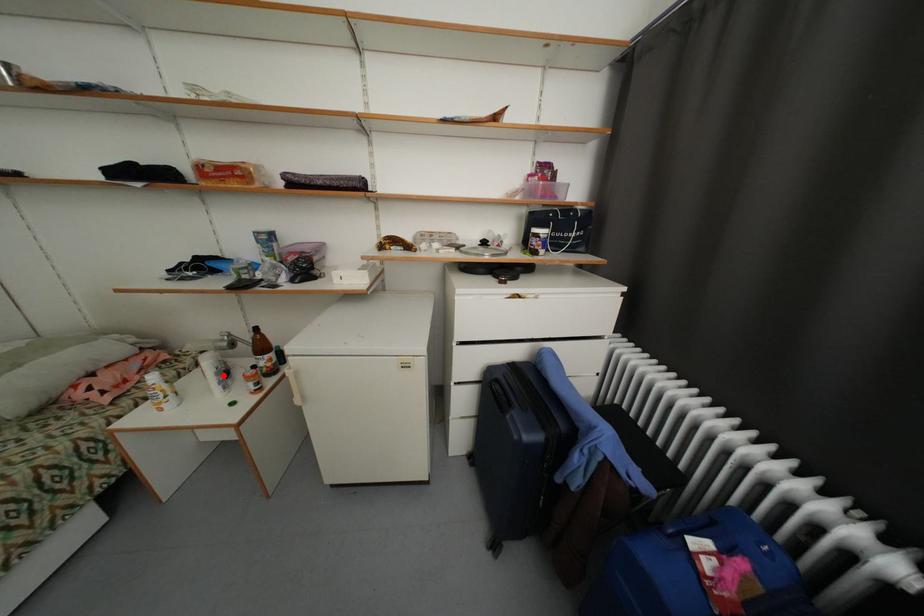
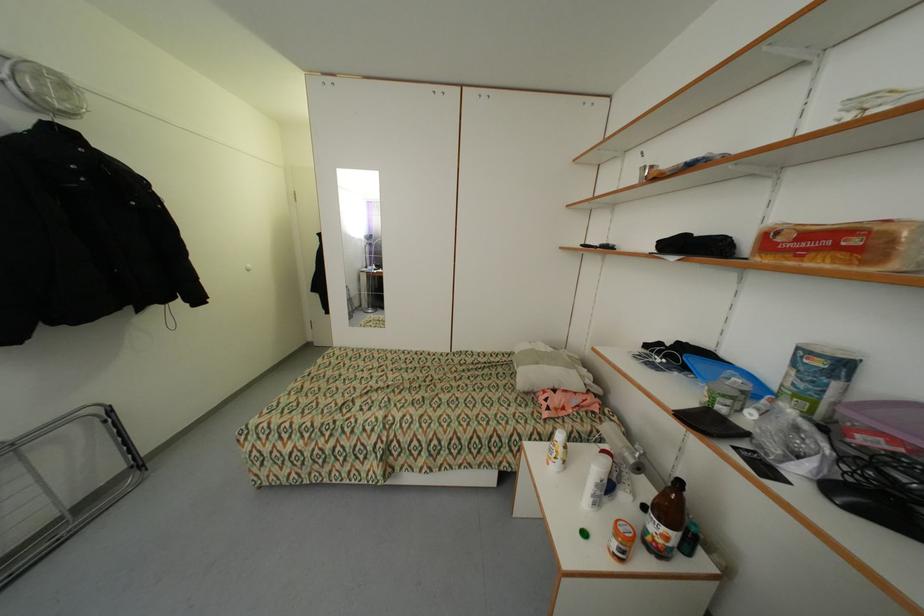
Question: A red point is marked in image1. In image2, is the corresponding 3D point closer to the camera or farther? Reply with the corresponding letter.

Choices:
 (A) The corresponding 3D point is closer.
 (B) The corresponding 3D point is farther.

Answer: (B)